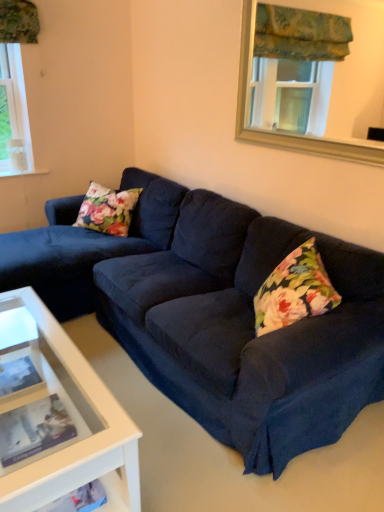
What is the approximate width of gold-framed mirror at upper center?

gold-framed mirror at upper center is 6.40 centimeters in width.

Image resolution: width=384 pixels, height=512 pixels. What do you see at coordinates (286, 134) in the screenshot? I see `gold-framed mirror at upper center` at bounding box center [286, 134].

Measure the distance between point (277, 134) and camera.

The depth of point (277, 134) is 8.20 feet.

Find the location of a particular element. gold-framed mirror at upper center is located at coordinates (286, 134).

The image size is (384, 512). Identify the location of suede dark blue couch at center. (215, 314).

The image size is (384, 512). Describe the element at coordinates (215, 314) in the screenshot. I see `suede dark blue couch at center` at that location.

Looking at this image, measure the distance between suede dark blue couch at center and camera.

suede dark blue couch at center is 4.86 feet from camera.

You are a GUI agent. You are given a task and a screenshot of the screen. Output one action in this format:
    pyautogui.click(x=<x>, y=<y>)
    Task: Click on the gold-framed mirror at upper center
    The width and height of the screenshot is (384, 512).
    Given the screenshot: What is the action you would take?
    pyautogui.click(x=286, y=134)

In the image, is suede dark blue couch at center on the left side or the right side of gold-framed mirror at upper center?

In the image, suede dark blue couch at center appears on the left side of gold-framed mirror at upper center.

Considering the relative positions of suede dark blue couch at center and gold-framed mirror at upper center in the image provided, is suede dark blue couch at center in front of gold-framed mirror at upper center?

Yes, the depth of suede dark blue couch at center is less than that of gold-framed mirror at upper center.

Which is behind, point (283, 243) or point (382, 166)?

Point (283, 243)

Looking at this image, from the image's perspective, is suede dark blue couch at center below gold-framed mirror at upper center?

Correct, suede dark blue couch at center appears lower than gold-framed mirror at upper center in the image.

From a real-world perspective, which object stands above the other?

In real-world perspective, gold-framed mirror at upper center is above.

Between suede dark blue couch at center and gold-framed mirror at upper center, which one has larger width?

suede dark blue couch at center is wider.

Does suede dark blue couch at center have a greater height compared to gold-framed mirror at upper center?

Indeed, suede dark blue couch at center has a greater height compared to gold-framed mirror at upper center.

Based on their sizes in the image, would you say suede dark blue couch at center is bigger or smaller than gold-framed mirror at upper center?

In the image, suede dark blue couch at center appears to be larger than gold-framed mirror at upper center.

Could gold-framed mirror at upper center be considered to be inside suede dark blue couch at center?

Definitely not — gold-framed mirror at upper center is not inside suede dark blue couch at center.

Are suede dark blue couch at center and gold-framed mirror at upper center far apart?

suede dark blue couch at center is near gold-framed mirror at upper center, not far away.

Is suede dark blue couch at center facing away from gold-framed mirror at upper center?

No, suede dark blue couch at center's orientation is not away from gold-framed mirror at upper center.

How many degrees apart are the facing directions of suede dark blue couch at center and gold-framed mirror at upper center?

The angle between the facing direction of suede dark blue couch at center and the facing direction of gold-framed mirror at upper center is 2.64 degrees.

Identify the location of window frame located above the suede dark blue couch at center (from the image's perspective). (286, 134).

Is gold-framed mirror at upper center to the right of suede dark blue couch at center from the viewer's perspective?

Yes, gold-framed mirror at upper center is to the right of suede dark blue couch at center.

Which object is further away from the camera taking this photo, gold-framed mirror at upper center or suede dark blue couch at center?

gold-framed mirror at upper center is more distant.

Does point (243, 119) come closer to viewer compared to point (286, 226)?

No, (243, 119) is further to viewer.

From the image's perspective, would you say gold-framed mirror at upper center is shown under suede dark blue couch at center?

No, from the image's perspective, gold-framed mirror at upper center is not below suede dark blue couch at center.

From a real-world perspective, which is physically above, gold-framed mirror at upper center or suede dark blue couch at center?

gold-framed mirror at upper center is physically above.

Is gold-framed mirror at upper center wider than suede dark blue couch at center?

In fact, gold-framed mirror at upper center might be narrower than suede dark blue couch at center.

Is gold-framed mirror at upper center taller than suede dark blue couch at center?

No.

Is gold-framed mirror at upper center smaller than suede dark blue couch at center?

Yes, gold-framed mirror at upper center is smaller than suede dark blue couch at center.

Is gold-framed mirror at upper center surrounding suede dark blue couch at center?

No, suede dark blue couch at center is located outside of gold-framed mirror at upper center.

Is gold-framed mirror at upper center not close to suede dark blue couch at center?

No.

From the picture: Does gold-framed mirror at upper center turn towards suede dark blue couch at center?

No, gold-framed mirror at upper center is not facing towards suede dark blue couch at center.

How many degrees apart are the facing directions of gold-framed mirror at upper center and suede dark blue couch at center?

The angular difference between gold-framed mirror at upper center and suede dark blue couch at center is 2.64 degrees.

Measure the distance from gold-framed mirror at upper center to suede dark blue couch at center.

A distance of 99.74 centimeters exists between gold-framed mirror at upper center and suede dark blue couch at center.

The width and height of the screenshot is (384, 512). Find the location of `window frame on the right of suede dark blue couch at center`. window frame on the right of suede dark blue couch at center is located at coordinates (286, 134).

This screenshot has height=512, width=384. Identify the location of window frame behind the suede dark blue couch at center. (286, 134).

Locate an element on the screen. The image size is (384, 512). window frame located above the suede dark blue couch at center (from the image's perspective) is located at coordinates (286, 134).